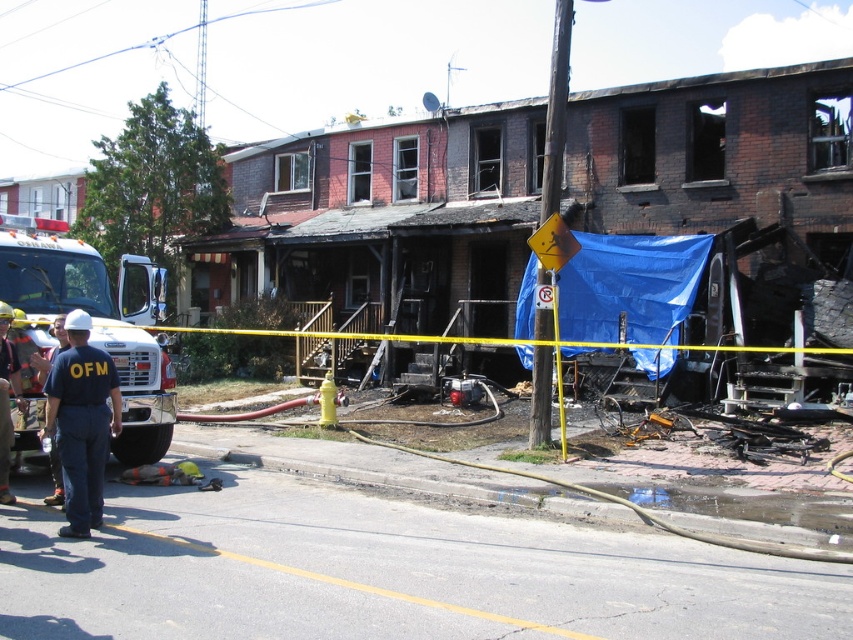
Question: Among these points, which one is nearest to the camera?

Choices:
 (A) coord(67,268)
 (B) coord(61,388)

Answer: (B)

Question: From the image, what is the correct spatial relationship of white glossy fire truck at left in relation to blue uniform at center?

Choices:
 (A) left
 (B) right

Answer: (A)

Question: Does white glossy fire truck at left appear on the left side of blue uniform at center?

Choices:
 (A) yes
 (B) no

Answer: (A)

Question: Does white glossy fire truck at left appear on the right side of blue uniform at center?

Choices:
 (A) yes
 (B) no

Answer: (B)

Question: Among these points, which one is farthest from the camera?

Choices:
 (A) (91, 472)
 (B) (99, 284)

Answer: (B)